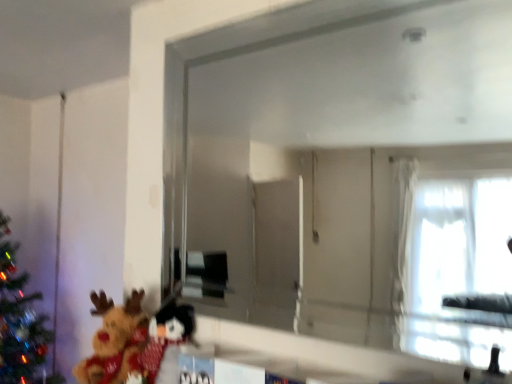
Question: Does clear glass mirror at center appear on the right side of fluffy plush at lower left?

Choices:
 (A) yes
 (B) no

Answer: (A)

Question: Is clear glass mirror at center aimed at fluffy plush at lower left?

Choices:
 (A) no
 (B) yes

Answer: (A)

Question: Considering the relative sizes of clear glass mirror at center and fluffy plush at lower left in the image provided, is clear glass mirror at center wider than fluffy plush at lower left?

Choices:
 (A) no
 (B) yes

Answer: (A)

Question: Considering the relative sizes of clear glass mirror at center and fluffy plush at lower left in the image provided, is clear glass mirror at center thinner than fluffy plush at lower left?

Choices:
 (A) no
 (B) yes

Answer: (B)

Question: Can you confirm if clear glass mirror at center is taller than fluffy plush at lower left?

Choices:
 (A) yes
 (B) no

Answer: (A)

Question: From the image's perspective, is clear glass mirror at center under fluffy plush at lower left?

Choices:
 (A) no
 (B) yes

Answer: (A)

Question: Can we say fluffy plush at lower left lies outside clear glass mirror at center?

Choices:
 (A) no
 (B) yes

Answer: (B)

Question: Is fluffy plush at lower left to the right of clear glass mirror at center from the viewer's perspective?

Choices:
 (A) no
 (B) yes

Answer: (A)

Question: From the image's perspective, is fluffy plush at lower left over clear glass mirror at center?

Choices:
 (A) no
 (B) yes

Answer: (A)

Question: Is fluffy plush at lower left bigger than clear glass mirror at center?

Choices:
 (A) yes
 (B) no

Answer: (B)

Question: Are fluffy plush at lower left and clear glass mirror at center making contact?

Choices:
 (A) no
 (B) yes

Answer: (A)

Question: Considering the relative positions of fluffy plush at lower left and clear glass mirror at center in the image provided, is fluffy plush at lower left in front of clear glass mirror at center?

Choices:
 (A) no
 (B) yes

Answer: (A)

Question: Relative to fluffy plush at lower left, is clear glass mirror at center in front or behind?

Choices:
 (A) behind
 (B) front

Answer: (B)